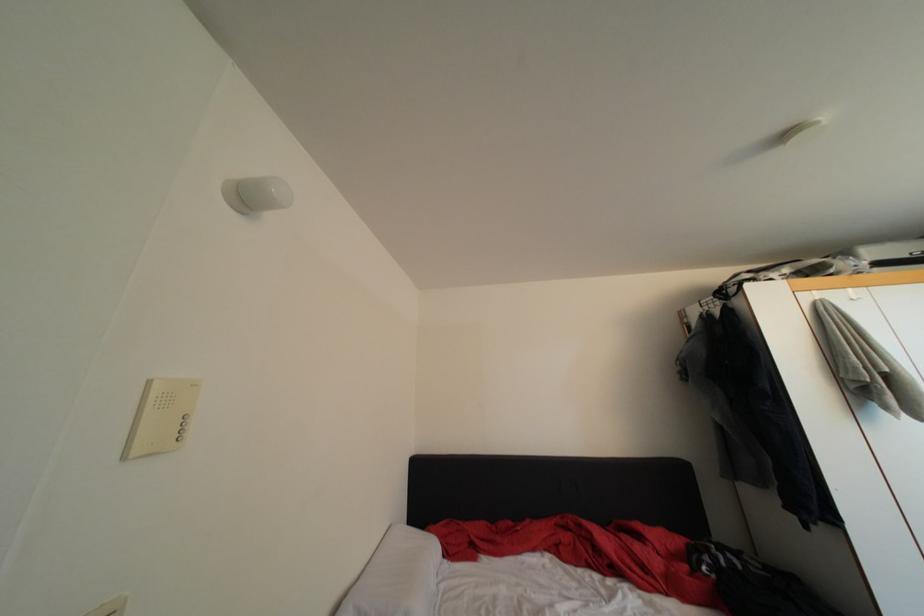
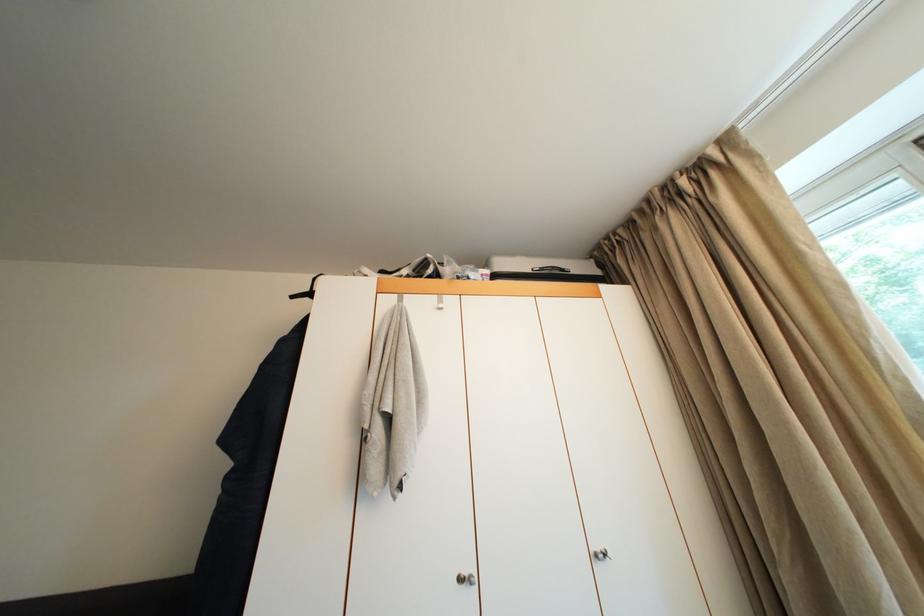
Question: In a continuous first-person perspective shot, in which direction is the camera moving?

Choices:
 (A) Left
 (B) Right
 (C) Forward
 (D) Backward

Answer: (B)